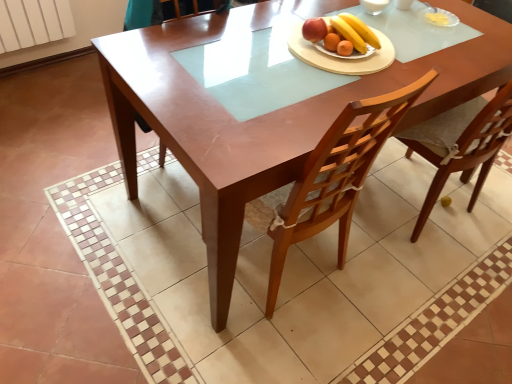
You are a GUI agent. You are given a task and a screenshot of the screen. Output one action in this format:
    pyautogui.click(x=<x>, y=<y>)
    Task: Click on the vacant region in front of wooden table at center
    This screenshot has width=512, height=384.
    Given the screenshot: What is the action you would take?
    pyautogui.click(x=313, y=326)